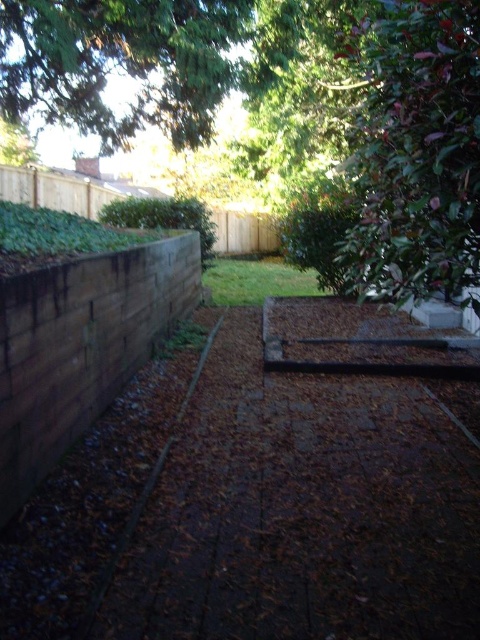
Question: Which point is closer to the camera?

Choices:
 (A) (235, 28)
 (B) (367, 168)

Answer: (B)

Question: Does green leafy tree at upper right come behind brown wood fence at upper center?

Choices:
 (A) yes
 (B) no

Answer: (B)

Question: Which point appears farthest from the camera in this image?

Choices:
 (A) (379, 100)
 (B) (177, 96)
 (C) (36, 200)

Answer: (B)

Question: Which is farther from the green leafy tree at upper right?

Choices:
 (A) brown wood fence at upper center
 (B) green leafy tree at upper center

Answer: (B)

Question: Is the position of green leafy tree at upper right less distant than that of brown wood fence at upper center?

Choices:
 (A) yes
 (B) no

Answer: (A)

Question: Is green leafy tree at upper right smaller than brown wood fence at upper center?

Choices:
 (A) no
 (B) yes

Answer: (B)